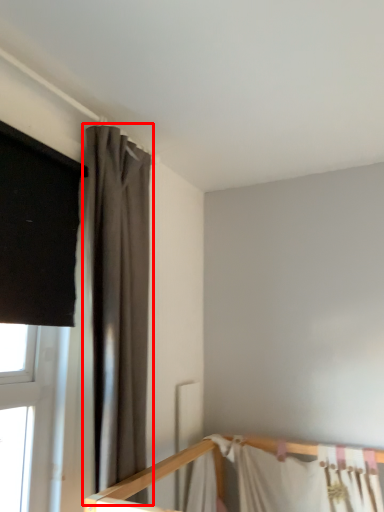
Question: From the image's perspective, what is the correct spatial positioning of curtain (annotated by the red box) in reference to bed?

Choices:
 (A) above
 (B) below

Answer: (A)